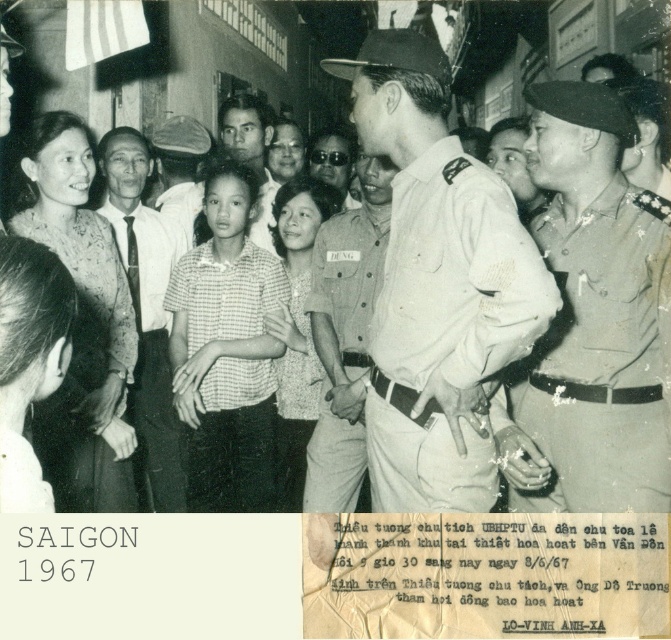
You are a photographer standing at the scene. You want to take a closeup photo of the smooth skin face at center. Your camera has a minimum focusing distance of 3 meters. Can you take the photo without moving closer?

The smooth skin face at center and the viewer are 4.15 meters apart from each other. Since the camera requires a minimum focusing distance of 3 meters, you can take the photo without moving closer because the distance is sufficient.

You are a photographer trying to capture a clear image of both the white shirt at center and the white textured shirt at center in the crowded scene. Based on their positions, which shirt do you think is more likely to be fully visible in the photo?

The white shirt at center is wider than the white textured shirt at center, so it might block part of the white textured shirt at center, making the latter less fully visible.